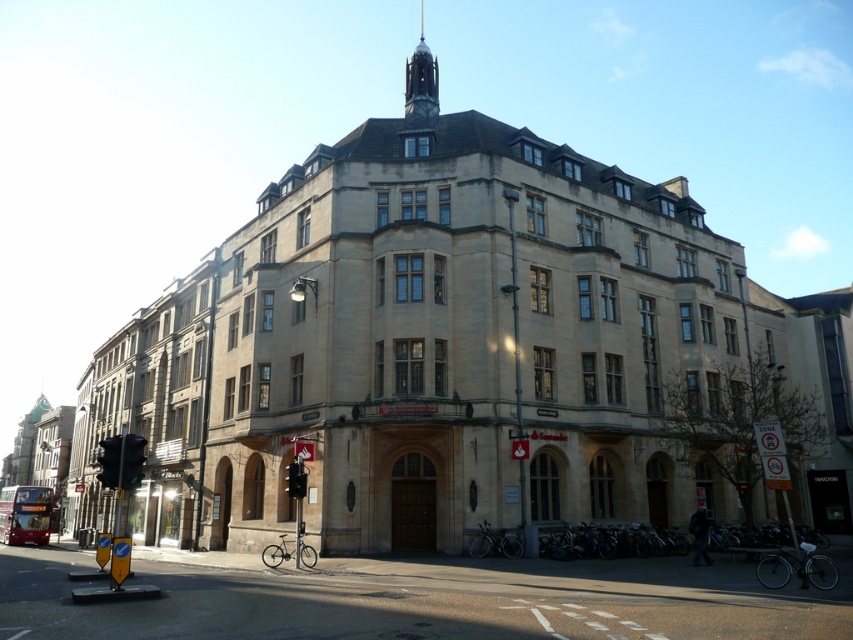
Is green glass traffic light at lower left to the right of metallic traffic light at lower left from the viewer's perspective?

Yes, green glass traffic light at lower left is to the right of metallic traffic light at lower left.

Is point (132, 468) less distant than point (115, 452)?

That is True.

In order to click on green glass traffic light at lower left in this screenshot , I will do `click(131, 460)`.

Can you confirm if metallic traffic light at lower left is positioned below metallic rectangular traffic light at center?

Indeed, metallic traffic light at lower left is positioned under metallic rectangular traffic light at center.

Which is behind, point (109, 472) or point (287, 492)?

Positioned behind is point (287, 492).

I want to click on metallic traffic light at lower left, so click(109, 461).

Who is positioned more to the right, green glass traffic light at lower left or metallic rectangular traffic light at center?

metallic rectangular traffic light at center

Is green glass traffic light at lower left positioned before metallic rectangular traffic light at center?

Yes, it is.

Identify the location of green glass traffic light at lower left. (131, 460).

Identify the location of green glass traffic light at lower left. The image size is (853, 640). (131, 460).